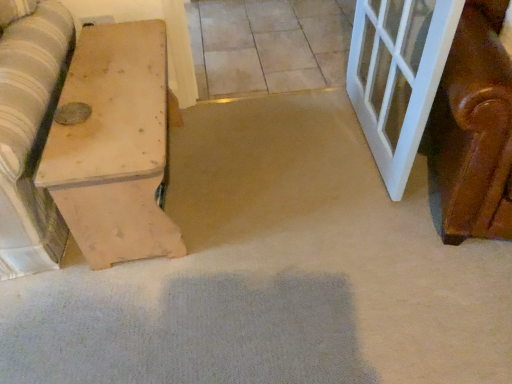
Question: From a real-world perspective, is light brown wood chest at left above or below neutral stone tile at center?

Choices:
 (A) below
 (B) above

Answer: (B)

Question: From their relative heights in the image, would you say light brown wood chest at left is taller or shorter than neutral stone tile at center?

Choices:
 (A) tall
 (B) short

Answer: (A)

Question: Is point (101, 243) closer or farther from the camera than point (238, 79)?

Choices:
 (A) farther
 (B) closer

Answer: (B)

Question: From the image's perspective, is neutral stone tile at center above or below light brown wood chest at left?

Choices:
 (A) above
 (B) below

Answer: (A)

Question: Does point (305, 41) appear closer or farther from the camera than point (50, 160)?

Choices:
 (A) farther
 (B) closer

Answer: (A)

Question: From a real-world perspective, relative to light brown wood chest at left, is neutral stone tile at center vertically above or below?

Choices:
 (A) below
 (B) above

Answer: (A)

Question: Is neutral stone tile at center in front of or behind light brown wood chest at left in the image?

Choices:
 (A) behind
 (B) front

Answer: (A)